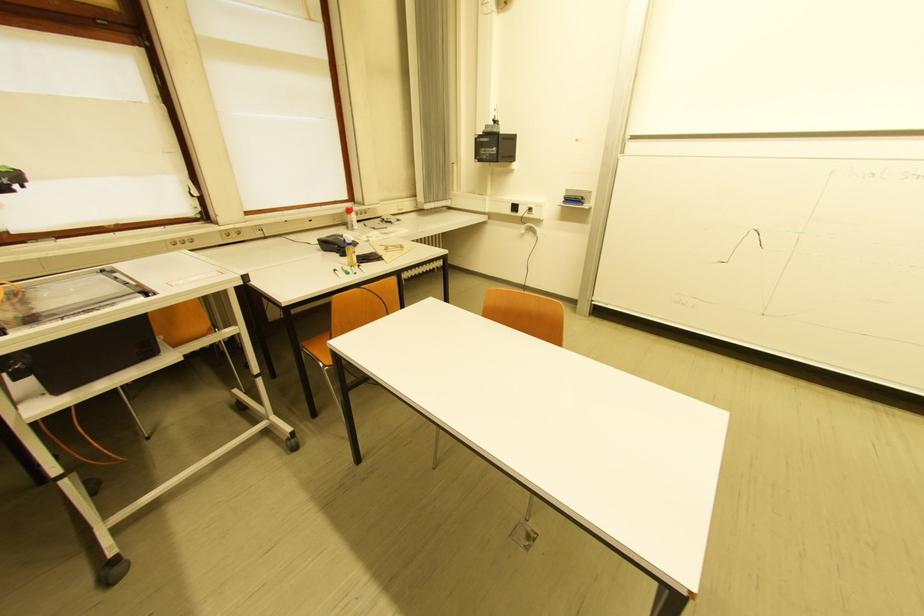
Find where to lift the red spray can. Please return your answer as a coordinate pair (x, y).

(350, 217)